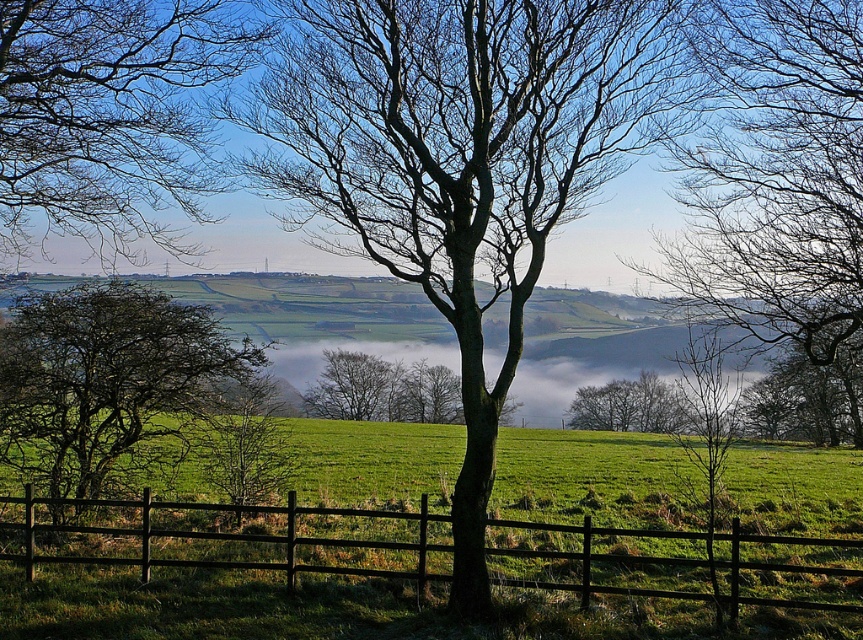
You are an artist sketching this scene. You want to ensure the proportions between the bare branches at center and the green leafy tree at left are accurate. Which one should you draw larger?

The bare branches at center should be drawn larger since it is larger in size than the green leafy tree at left according to the description.

You are a painter standing in the field and want to paint both the green leafy tree at left and the smooth gray tree at center. Which tree should you paint first if you want to paint the one closer to you first?

You should paint the green leafy tree at left first because it is in front of the smooth gray tree at center, making it closer to you.

You are standing in the field and want to take a photo of the green leafy tree at left. However, the bare branches at center are blocking your view. Can you move to the right or left to avoid the branches?

The bare branches at center are in front of the green leafy tree at left, so moving to the right would allow you to avoid the branches and get a clear view of the green leafy tree at left.